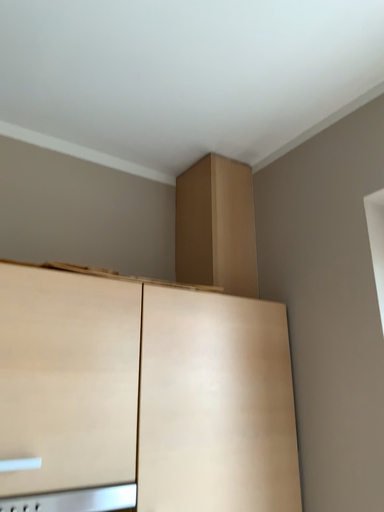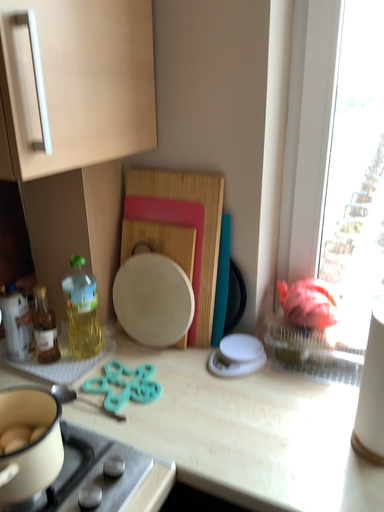
Question: Which way did the camera rotate in the video?

Choices:
 (A) rotated upward
 (B) rotated downward

Answer: (B)